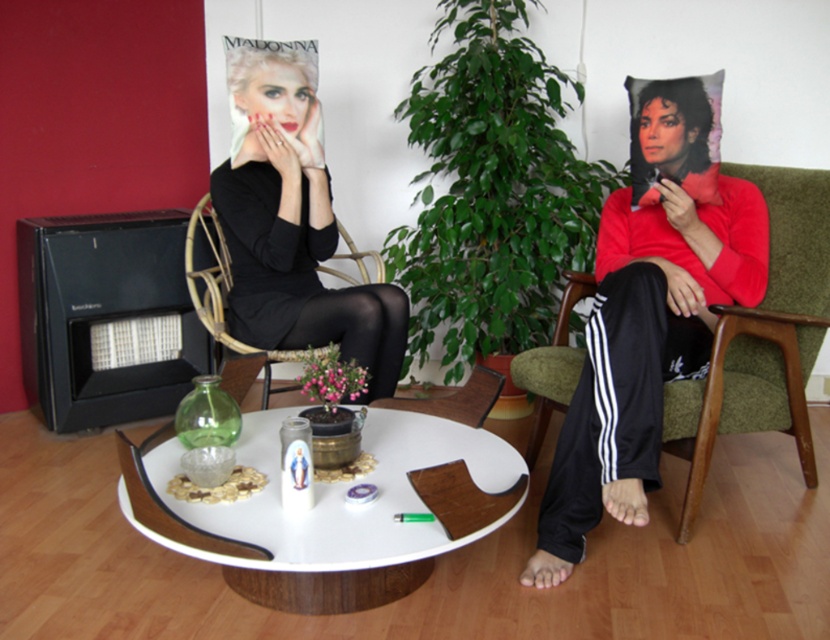
You are planning to place a new decorative item on the white glossy round table at center. Considering the size of the table and the black matte dress at center, will the table have enough space to accommodate the item without overlapping the dress?

The white glossy round table at center is bigger than the black matte dress at center, so there should be enough space to place the decorative item without overlapping the dress.

You are a photographer who wants to take a closeup shot of the black matte dress at center. The camera you have can focus on objects within 5 feet. Is the camera positioned close enough to the dress?

The black matte dress at center and camera are 7.71 feet apart from each other. Since the camera can only focus within 5 feet, the distance is too far for a clear closeup shot.